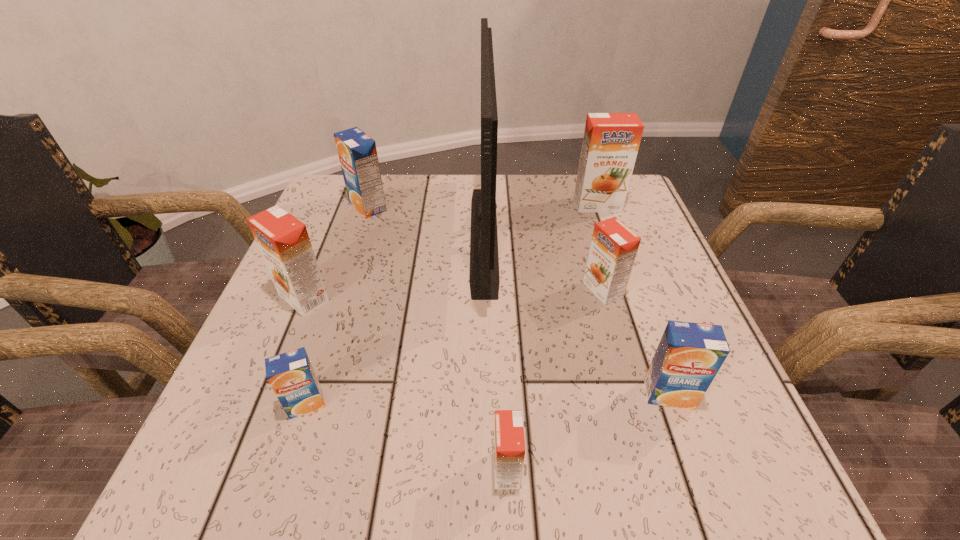
This screenshot has width=960, height=540. Identify the location of free space between the second smallest blue orange_juice and the biggest blue orange_juice. (518, 300).

Where is `vacant area that lies between the monitor and the third smallest orange orange juice`? This screenshot has height=540, width=960. vacant area that lies between the monitor and the third smallest orange orange juice is located at coordinates (394, 267).

The width and height of the screenshot is (960, 540). What are the coordinates of `unoccupied area between the smallest blue orange_juice and the tallest object` in the screenshot? It's located at [x=395, y=320].

I want to click on vacant space in between the tallest orange juice and the third smallest orange orange juice, so click(450, 251).

At what (x,y) coordinates should I click in order to perform the action: click on free space between the biggest blue orange_juice and the monitor. Please return your answer as a coordinate pair (x, y). Image resolution: width=960 pixels, height=540 pixels. Looking at the image, I should click on (426, 221).

The image size is (960, 540). Identify the location of free space between the third biggest orange orange juice and the monitor. (543, 263).

Find the location of a particular element. Image resolution: width=960 pixels, height=540 pixels. free space between the second smallest orange orange juice and the tallest object is located at coordinates (543, 263).

The width and height of the screenshot is (960, 540). Find the location of `blank region between the farthest orange orange juice and the smallest blue orange_juice`. blank region between the farthest orange orange juice and the smallest blue orange_juice is located at coordinates pyautogui.click(x=452, y=305).

Find the location of a particular element. object identified as the closest to the second biggest orange orange juice is located at coordinates (291, 375).

Locate an element on the screen. The width and height of the screenshot is (960, 540). object that ranks as the second closest to the smallest blue orange_juice is located at coordinates (509, 445).